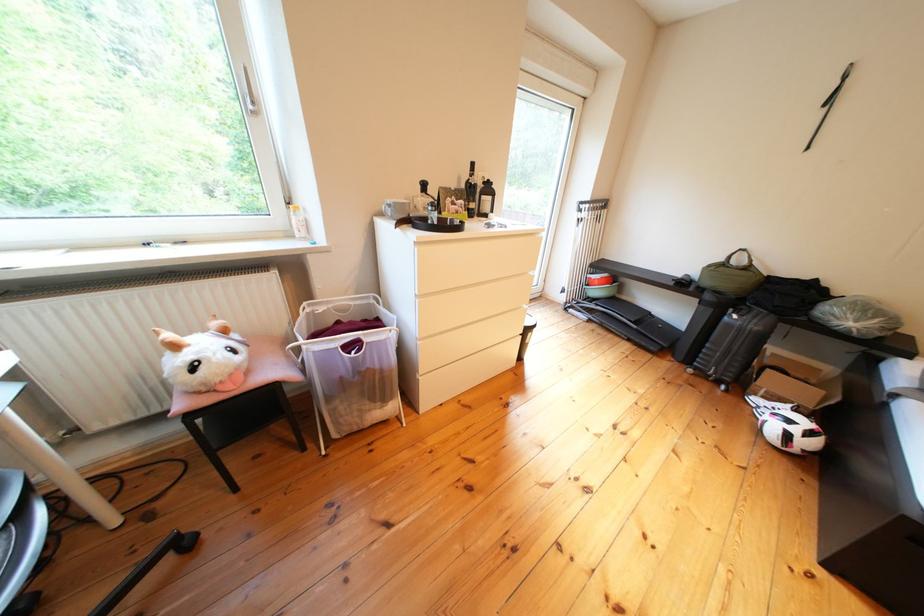
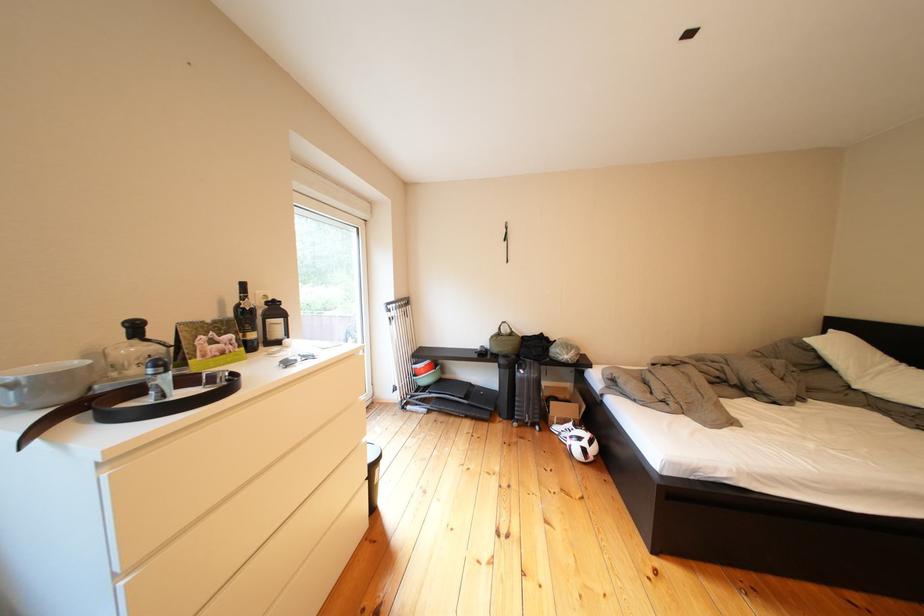
Find the pixel in the second image that matches point (771, 405) in the first image.

(570, 432)